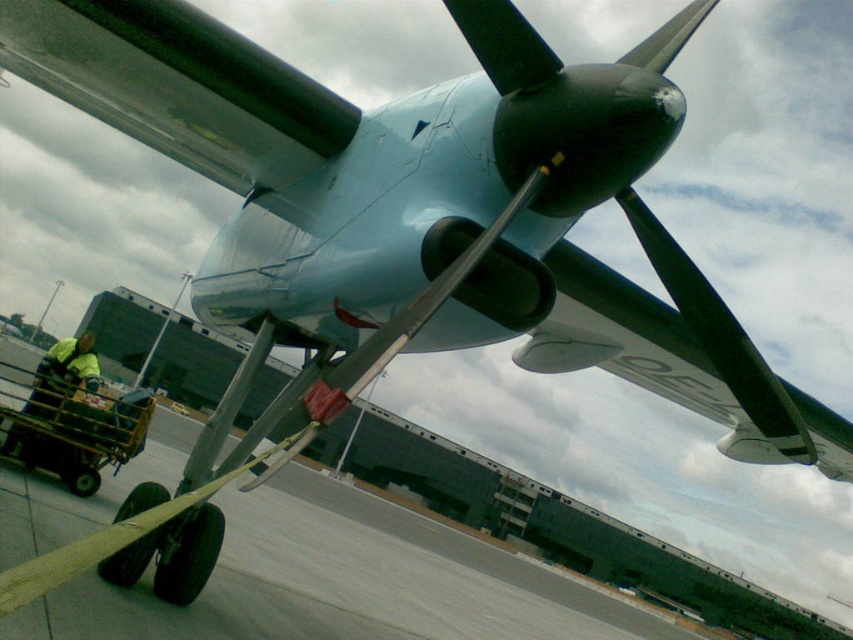
Question: Can you confirm if metallic yellow cart at lower left is bigger than yellow reflective vest at lower left?

Choices:
 (A) no
 (B) yes

Answer: (B)

Question: Is metallic yellow cart at lower left to the right of yellow reflective vest at lower left from the viewer's perspective?

Choices:
 (A) no
 (B) yes

Answer: (A)

Question: Which object is farther from the camera taking this photo?

Choices:
 (A) metallic yellow cart at lower left
 (B) yellow reflective vest at lower left

Answer: (B)

Question: Considering the relative positions of metallic yellow cart at lower left and yellow reflective vest at lower left in the image provided, where is metallic yellow cart at lower left located with respect to yellow reflective vest at lower left?

Choices:
 (A) left
 (B) right

Answer: (A)